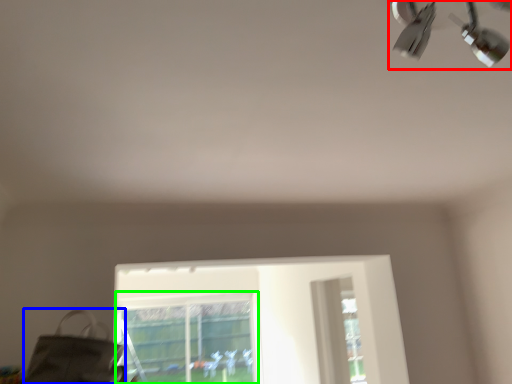
Question: Which object is the closest to the lamp (highlighted by a red box)? Choose among these: messenger bag (highlighted by a blue box) or bay window (highlighted by a green box).

Choices:
 (A) messenger bag
 (B) bay window

Answer: (A)